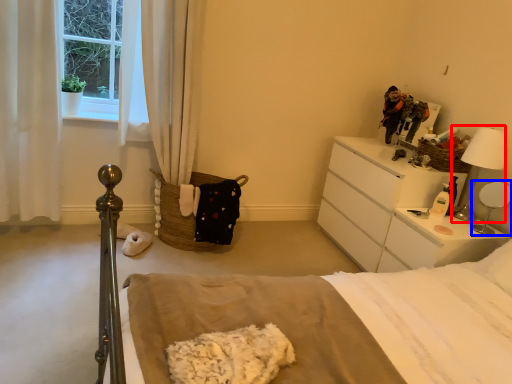
Question: Among these objects, which one is nearest to the camera, table lamp (highlighted by a red box) or table lamp (highlighted by a blue box)?

Choices:
 (A) table lamp
 (B) table lamp

Answer: (B)